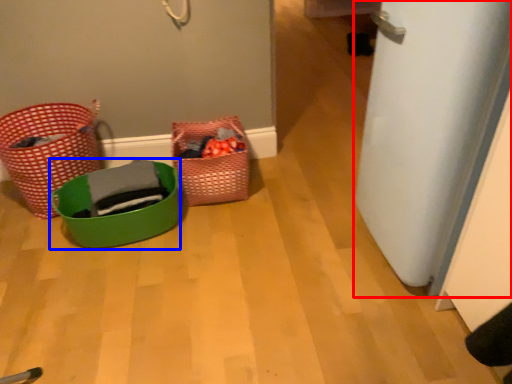
Question: Which of the following is the closest to the observer, door (highlighted by a red box) or basket (highlighted by a blue box)?

Choices:
 (A) door
 (B) basket

Answer: (A)